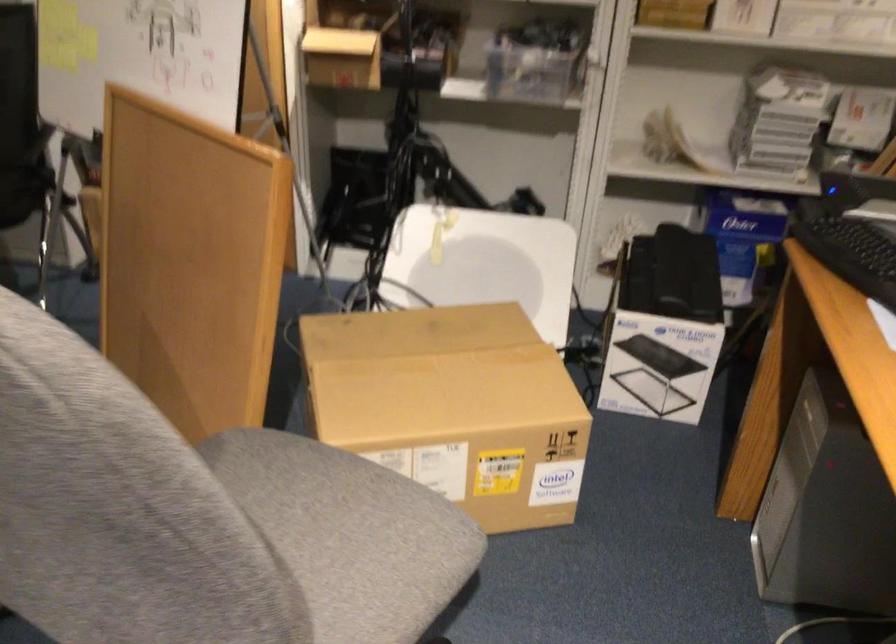
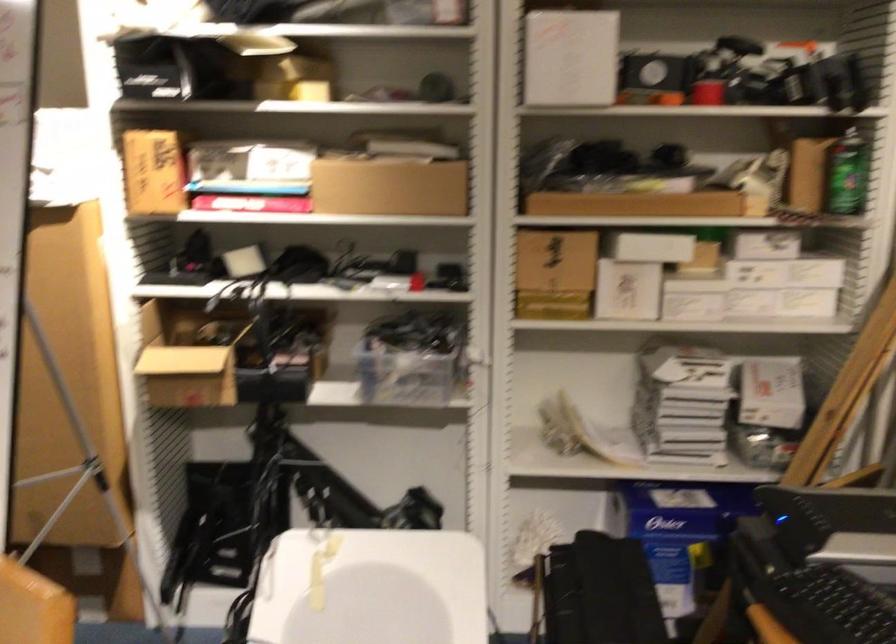
Where in the second image is the point corresponding to [530,71] from the first image?

(403, 375)